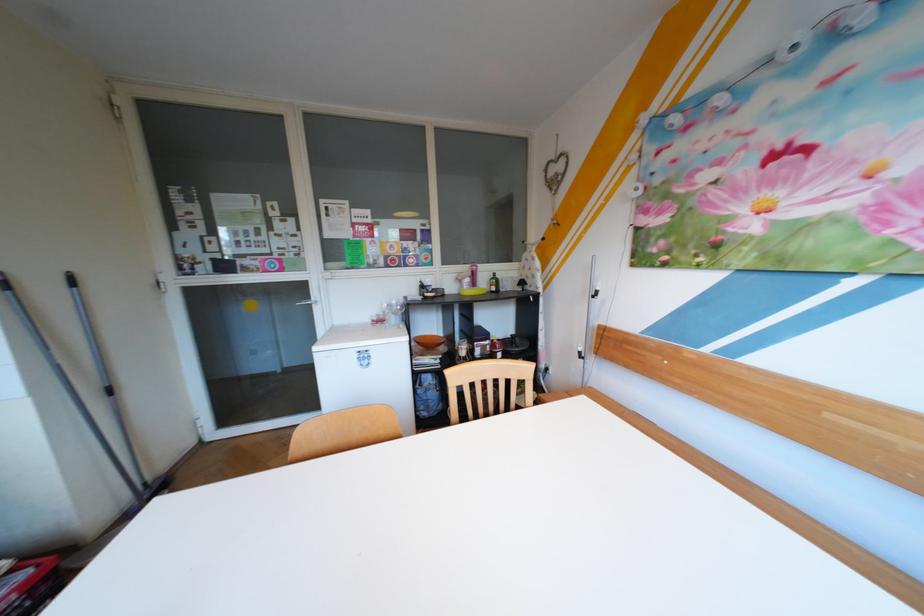
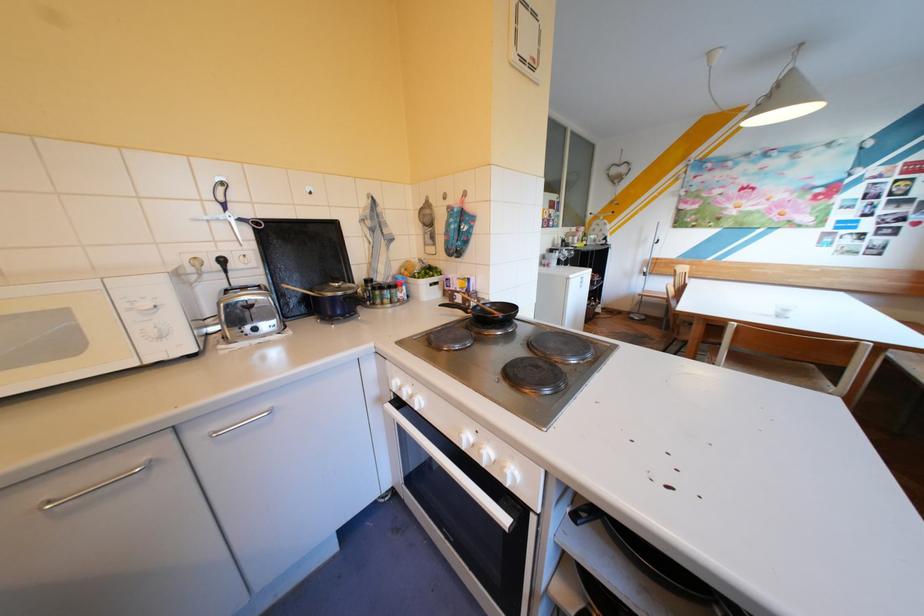
Question: I am providing you with two images of the same scene from different viewpoints. After the viewpoint changes to image2, which objects are now occluded?

Choices:
 (A) toaster press lever
 (B) frying pan handle
 (C) teal electric toothbrush
 (D) white freezer lid

Answer: (D)